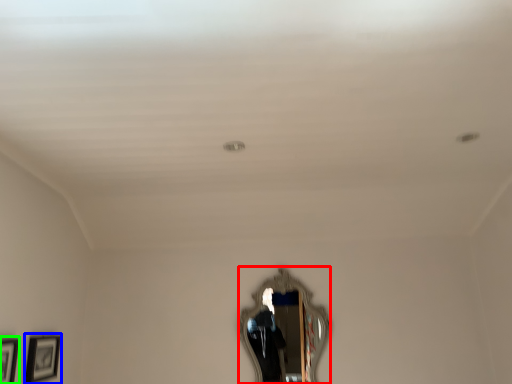
Question: Which is nearer to the mirror (highlighted by a red box)? picture frame (highlighted by a blue box) or picture frame (highlighted by a green box).

Choices:
 (A) picture frame
 (B) picture frame

Answer: (A)